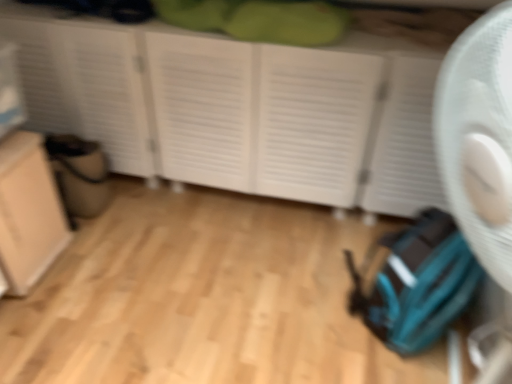
Question: Considering the positions of point (45, 165) and point (339, 61), is point (45, 165) closer or farther from the camera than point (339, 61)?

Choices:
 (A) closer
 (B) farther

Answer: (B)

Question: In terms of size, does beige matte cabinet at lower left appear bigger or smaller than white matte cupboard at center?

Choices:
 (A) big
 (B) small

Answer: (B)

Question: Is beige matte cabinet at lower left in front of or behind white matte cupboard at center in the image?

Choices:
 (A) behind
 (B) front

Answer: (B)

Question: Based on their sizes in the image, would you say white matte cupboard at center is bigger or smaller than beige matte cabinet at lower left?

Choices:
 (A) small
 (B) big

Answer: (B)

Question: Looking at their shapes, would you say white matte cupboard at center is wider or thinner than beige matte cabinet at lower left?

Choices:
 (A) wide
 (B) thin

Answer: (A)

Question: Visually, is white matte cupboard at center positioned to the left or to the right of beige matte cabinet at lower left?

Choices:
 (A) right
 (B) left

Answer: (A)

Question: Is white matte cupboard at center inside or outside of beige matte cabinet at lower left?

Choices:
 (A) inside
 (B) outside

Answer: (B)